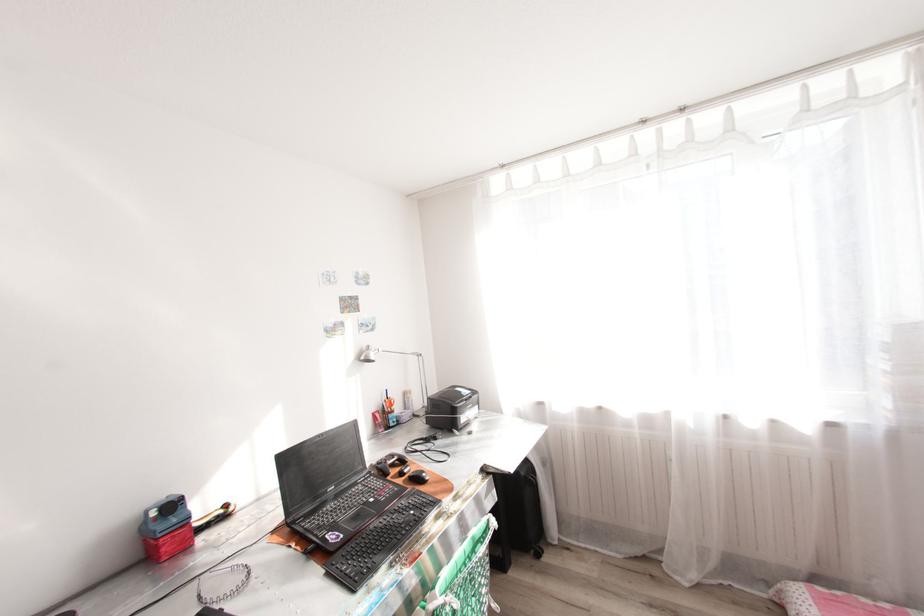
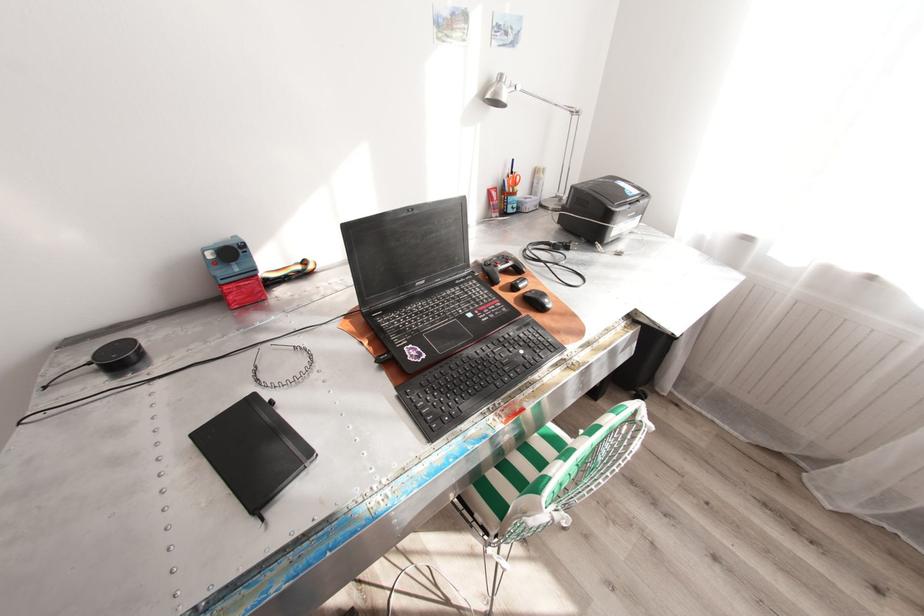
The first image is from the beginning of the video and the second image is from the end. How did the camera likely rotate when shooting the video?

The camera rotated toward left-down.